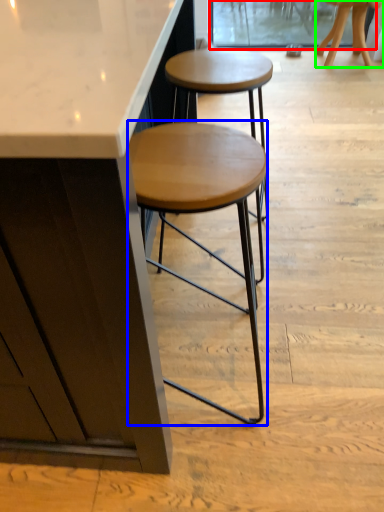
Question: Which is nearer to the screen door (highlighted by a red box)? stool (highlighted by a blue box) or stool (highlighted by a green box).

Choices:
 (A) stool
 (B) stool

Answer: (B)